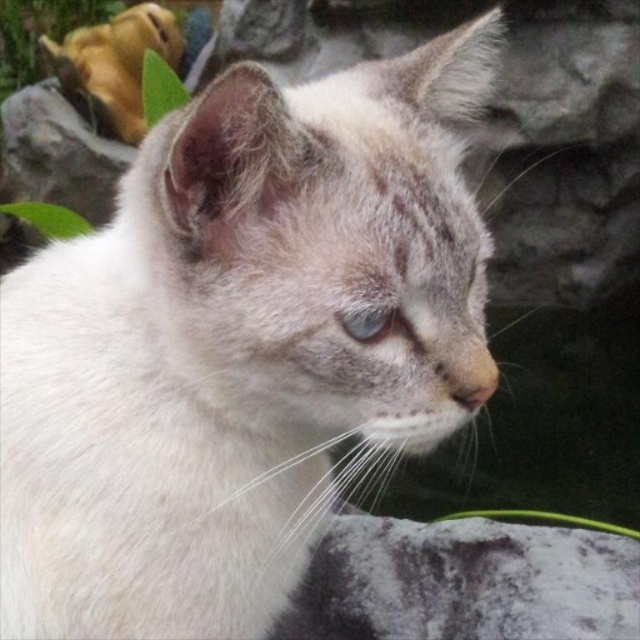
You are a photographer trying to capture the cat in the scene. You want to ensure both the fuzzy gray stone at lower right and the blue glossy eye at center are clearly visible in your shot. Given their sizes, which object will require you to adjust your focus more carefully to ensure clarity?

The fuzzy gray stone at lower right is larger than the blue glossy eye at center, so the smaller blue glossy eye at center may need more careful focus adjustment to ensure clarity in the photograph.

You are a photographer trying to capture the cat in the image. You notice the fuzzy gray stone at lower right and the blue glossy eye at center. Which object is positioned higher up in the image?

The fuzzy gray stone at lower right is much taller than the blue glossy eye at center, so it is positioned higher up in the image.

You are a cat owner who wants to place a small toy 3 feet away from your cat. The cat is sitting on the fuzzy gray stone at lower right. Can you place the toy within reach of the cat?

The distance between the fuzzy gray stone at lower right and the viewer is 4.63 feet, so placing the toy 3 feet away from the cat would be within reach.